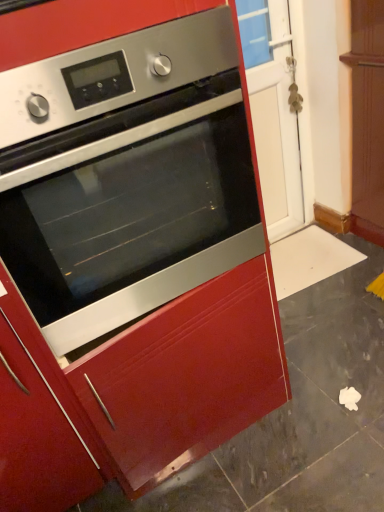
Find the location of a particular element. empty space that is ontop of glossy wood drawer at center (from a real-world perspective) is located at coordinates (311, 380).